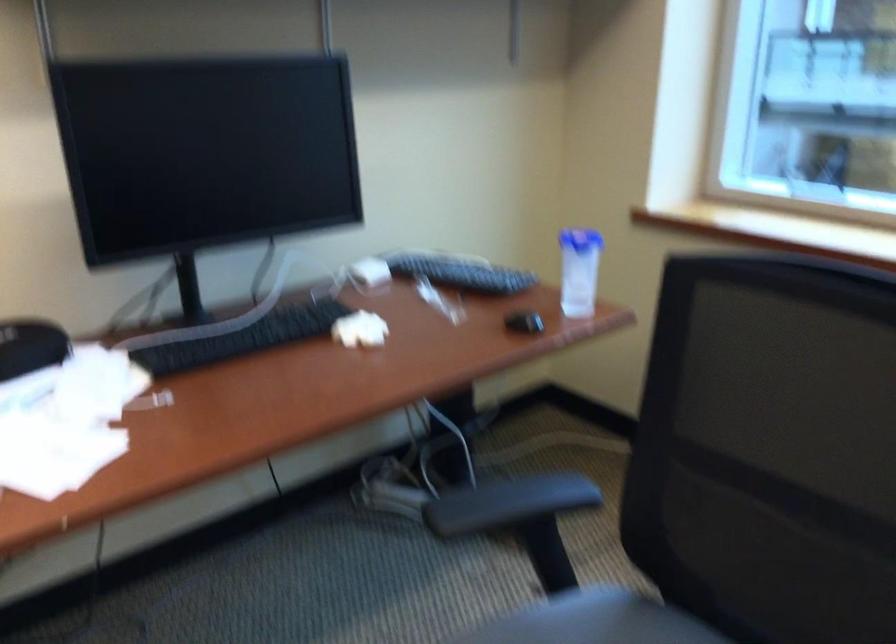
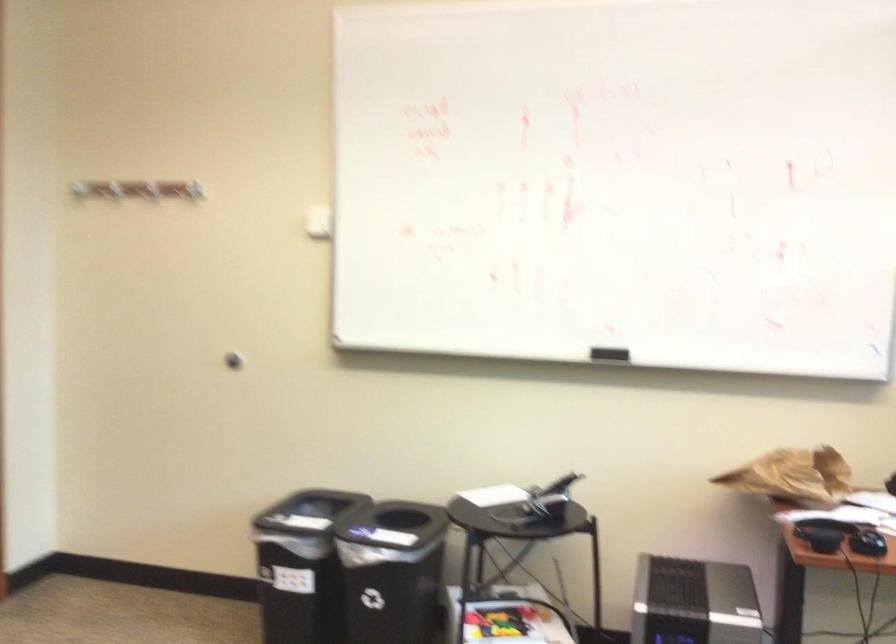
Question: How did the camera likely rotate?

Choices:
 (A) Left
 (B) Right
 (C) Up
 (D) Down

Answer: (A)